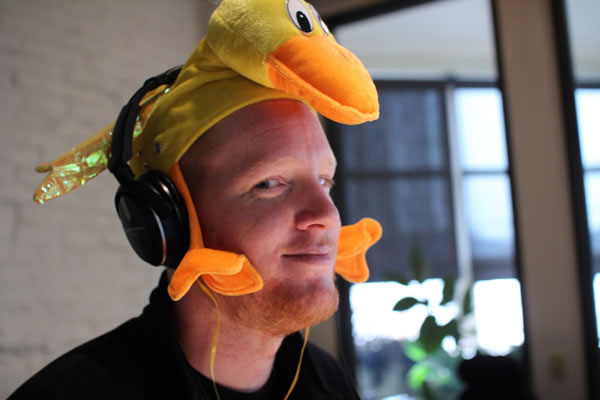
Image resolution: width=600 pixels, height=400 pixels. Find the location of `tan support beam`. tan support beam is located at coordinates (547, 245).